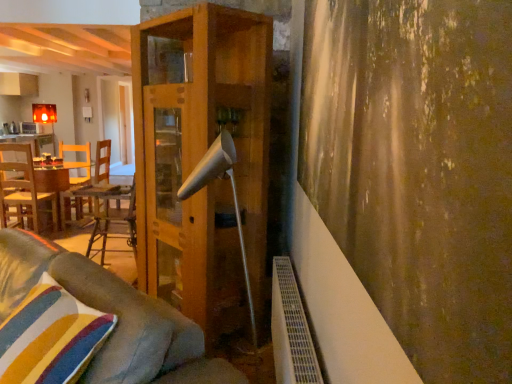
You are a GUI agent. You are given a task and a screenshot of the screen. Output one action in this format:
    pyautogui.click(x=<x>, y=<y>)
    Task: Click on the wooden shelf at center
    
    Given the screenshot: What is the action you would take?
    pyautogui.click(x=200, y=159)

What do you see at coordinates (418, 169) in the screenshot?
I see `textured brown curtain at right` at bounding box center [418, 169].

The width and height of the screenshot is (512, 384). What do you see at coordinates (90, 324) in the screenshot?
I see `velvet gray couch at lower left` at bounding box center [90, 324].

What do you see at coordinates (29, 141) in the screenshot?
I see `wooden table at left, marked as the 2th table in a bottom-to-top arrangement` at bounding box center [29, 141].

Locate an element on the screen. The image size is (512, 384). white matte lamp at center is located at coordinates (233, 198).

Where is `wooden shelf at center`? This screenshot has width=512, height=384. wooden shelf at center is located at coordinates (200, 159).

Is textured brown curtain at right smaller than white matte lamp at center?

Indeed, textured brown curtain at right has a smaller size compared to white matte lamp at center.

Based on their positions, is textured brown curtain at right located to the left or right of white matte lamp at center?

A: textured brown curtain at right is to the right of white matte lamp at center.

Between point (435, 304) and point (204, 175), which one is positioned in front?

The point (435, 304) is closer to the camera.

Could you tell me if textured brown curtain at right is facing white matte lamp at center?

No, textured brown curtain at right is not facing towards white matte lamp at center.

Between wooden shelf at center and striped fabric pillow at lower left, which one has more height?

Standing taller between the two is wooden shelf at center.

From the image's perspective, which is above, wooden shelf at center or striped fabric pillow at lower left?

From the image's view, wooden shelf at center is above.

Considering the relative positions of wooden shelf at center and striped fabric pillow at lower left in the image provided, is wooden shelf at center to the left or to the right of striped fabric pillow at lower left?

Based on their positions, wooden shelf at center is located to the right of striped fabric pillow at lower left.

In terms of height, does velvet gray couch at lower left look taller or shorter compared to striped fabric pillow at lower left?

Clearly, velvet gray couch at lower left is taller compared to striped fabric pillow at lower left.

How far apart are velvet gray couch at lower left and striped fabric pillow at lower left?

velvet gray couch at lower left is 3.01 inches away from striped fabric pillow at lower left.

Which is more to the right, velvet gray couch at lower left or striped fabric pillow at lower left?

striped fabric pillow at lower left is more to the right.

Which object is wider, striped fabric pillow at lower left or woodenmaterial/texturetable at left, which is the second table from left to right?

With larger width is woodenmaterial/texturetable at left, which is the second table from left to right.

Locate an element on the screen. This screenshot has height=384, width=512. the 1st table behind the striped fabric pillow at lower left is located at coordinates (62, 186).

Which object is more forward, wooden shelf at center or wooden table at left, marked as the 2th table in a bottom-to-top arrangement?

wooden shelf at center is in front.

Between wooden shelf at center and wooden table at left, which is the first table from left to right, which one has less height?

wooden table at left, which is the first table from left to right.

From the image's perspective, is wooden shelf at center positioned above or below wooden table at left, marked as the 2th table in a bottom-to-top arrangement?

wooden shelf at center is situated lower than wooden table at left, marked as the 2th table in a bottom-to-top arrangement, in the image.

Is wooden shelf at center to the right of wooden table at left, arranged as the 2th table when viewed from the front, from the viewer's perspective?

Correct, you'll find wooden shelf at center to the right of wooden table at left, arranged as the 2th table when viewed from the front.

From a real-world perspective, who is located lower, woodenmaterial/texturetable at left, positioned as the 1th table in right-to-left order, or velvet gray couch at lower left?

woodenmaterial/texturetable at left, positioned as the 1th table in right-to-left order, is physically lower.

Is woodenmaterial/texturetable at left, which is the second table from left to right, oriented away from velvet gray couch at lower left?

No, woodenmaterial/texturetable at left, which is the second table from left to right,'s orientation is not away from velvet gray couch at lower left.

Is the position of woodenmaterial/texturetable at left, placed as the second table when sorted from back to front, less distant than that of velvet gray couch at lower left?

No.

From the image's perspective, is velvet gray couch at lower left positioned above or below woodenmaterial/texturetable at left, the second table in the top-to-bottom sequence?

velvet gray couch at lower left is situated lower than woodenmaterial/texturetable at left, the second table in the top-to-bottom sequence, in the image.

Which is more to the left, velvet gray couch at lower left or woodenmaterial/texturetable at left, placed as the second table when sorted from back to front?

Positioned to the left is woodenmaterial/texturetable at left, placed as the second table when sorted from back to front.

Does velvet gray couch at lower left have a greater width compared to woodenmaterial/texturetable at left, which is the second table from left to right?

No, velvet gray couch at lower left is not wider than woodenmaterial/texturetable at left, which is the second table from left to right.

Looking at this image, is velvet gray couch at lower left shorter than woodenmaterial/texturetable at left, the second table in the top-to-bottom sequence?

No, velvet gray couch at lower left is not shorter than woodenmaterial/texturetable at left, the second table in the top-to-bottom sequence.

Identify the location of curtain lying on the right of white matte lamp at center. This screenshot has width=512, height=384. (418, 169).

In order to click on shelf located above the striped fabric pillow at lower left (from a real-world perspective) in this screenshot , I will do `click(200, 159)`.

When comparing their distances from textured brown curtain at right, does wooden table at left, marked as the 2th table in a bottom-to-top arrangement, or wooden shelf at center seem closer?

wooden shelf at center lies closer to textured brown curtain at right than the other object.

When comparing their distances from woodenmaterial/texturetable at left, positioned as the 1th table in right-to-left order, does velvet gray couch at lower left or white matte lamp at center seem closer?

Based on the image, velvet gray couch at lower left appears to be nearer to woodenmaterial/texturetable at left, positioned as the 1th table in right-to-left order.

Considering their positions, is wooden shelf at center positioned further to velvet gray couch at lower left than matte white cabinet at upper left?

matte white cabinet at upper left is positioned further to the anchor velvet gray couch at lower left.

Estimate the real-world distances between objects in this image. Which object is further from velvet gray couch at lower left, wooden table at left, which is the first table from left to right, or woodenmaterial/texturetable at left, which is the second table from left to right?

wooden table at left, which is the first table from left to right, is positioned further to the anchor velvet gray couch at lower left.

Looking at this image, when comparing their distances from matte white cabinet at upper left, does wooden table at left, which is the 2th table in right-to-left order, or wooden shelf at center seem further?

wooden shelf at center is further to matte white cabinet at upper left.

From the image, which object appears to be farther from textured brown curtain at right, wooden shelf at center or woodenmaterial/texturetable at left, placed as the second table when sorted from back to front?

The object further to textured brown curtain at right is woodenmaterial/texturetable at left, placed as the second table when sorted from back to front.

Estimate the real-world distances between objects in this image. Which object is closer to wooden table at left, marked as the 2th table in a bottom-to-top arrangement, wooden shelf at center or velvet gray couch at lower left?

wooden shelf at center is positioned closer to the anchor wooden table at left, marked as the 2th table in a bottom-to-top arrangement.

Looking at the image, which one is located closer to wooden shelf at center, matte white cabinet at upper left or white matte lamp at center?

Among the two, white matte lamp at center is located nearer to wooden shelf at center.

In order to click on lamp between textured brown curtain at right and wooden shelf at center from front to back in this screenshot , I will do `click(233, 198)`.

Locate an element on the screen. lamp located between velvet gray couch at lower left and matte white cabinet at upper left in the depth direction is located at coordinates (233, 198).

Locate an element on the screen. The height and width of the screenshot is (384, 512). lamp positioned between striped fabric pillow at lower left and wooden table at left, arranged as the 2th table when viewed from the front, from near to far is located at coordinates (233, 198).

The width and height of the screenshot is (512, 384). Find the location of `lamp located between textured brown curtain at right and wooden table at left, which is the first table from left to right, in the depth direction`. lamp located between textured brown curtain at right and wooden table at left, which is the first table from left to right, in the depth direction is located at coordinates (233, 198).